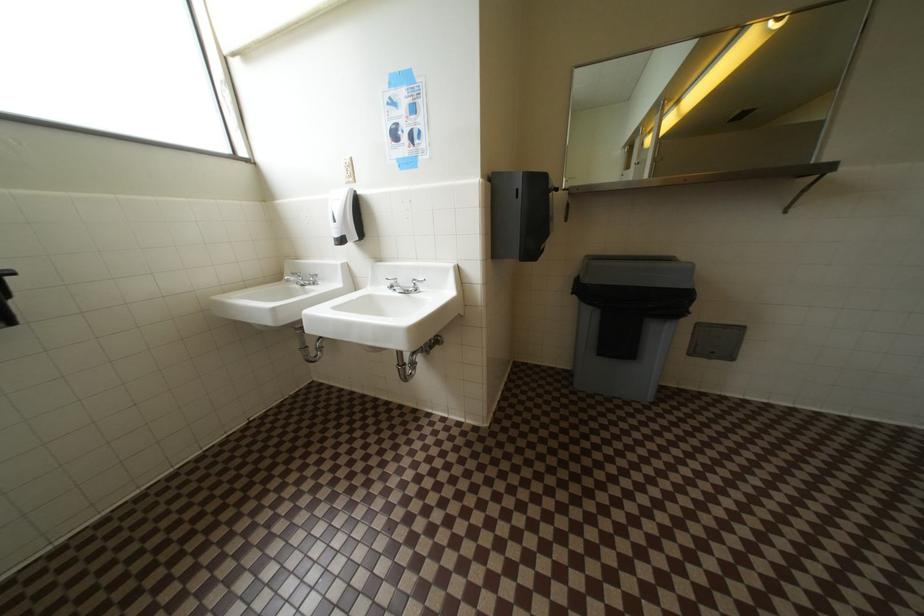
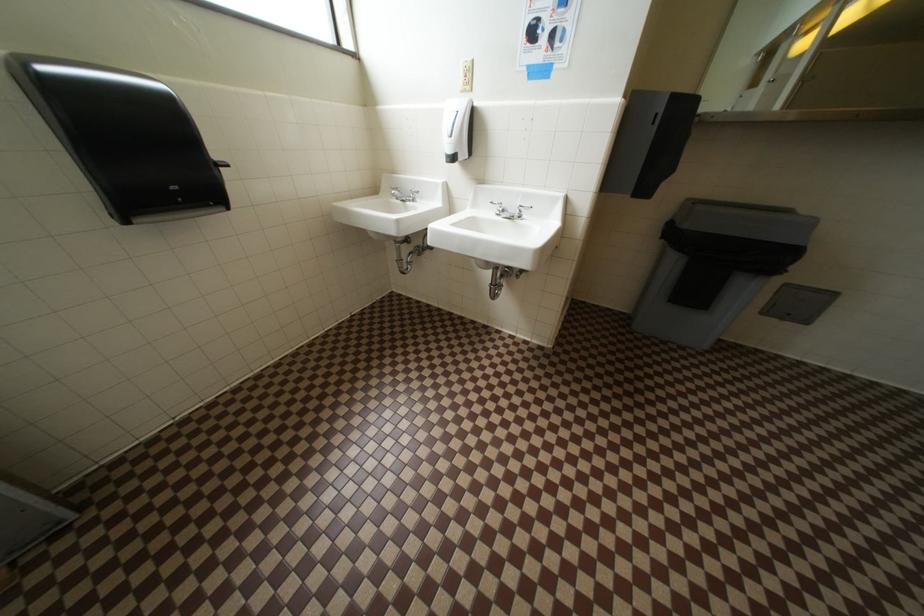
Which direction would the cameraman need to move to produce the second image?

The cameraman walked toward left, backward.